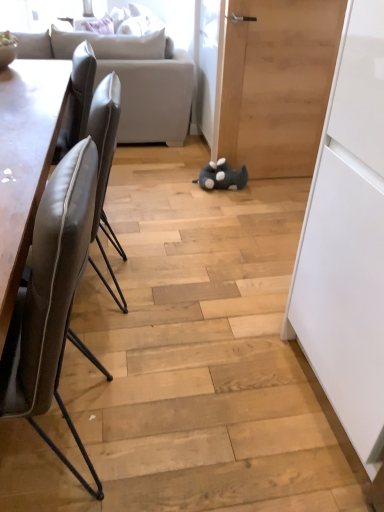
Question: From a real-world perspective, relative to wooden door at center, is leather at left, which appears as the first chair when viewed from the back, vertically above or below?

Choices:
 (A) below
 (B) above

Answer: (A)

Question: Is leather at left, which is the 2th chair in front-to-back order, in front of or behind wooden door at center in the image?

Choices:
 (A) front
 (B) behind

Answer: (A)

Question: Which object is the closest to the leather at left, which is the 2th chair in front-to-back order?

Choices:
 (A) light gray fabric couch at upper left
 (B) wooden door at center
 (C) leather at left, the 1th chair viewed from the front
 (D) gray plush toy at center

Answer: (C)

Question: Estimate the real-world distances between objects in this image. Which object is farther from the light gray fabric couch at upper left?

Choices:
 (A) leather at left, which is counted as the second chair, starting from the back
 (B) gray plush toy at center
 (C) wooden door at center
 (D) leather at left, which is the 2th chair in front-to-back order

Answer: (A)